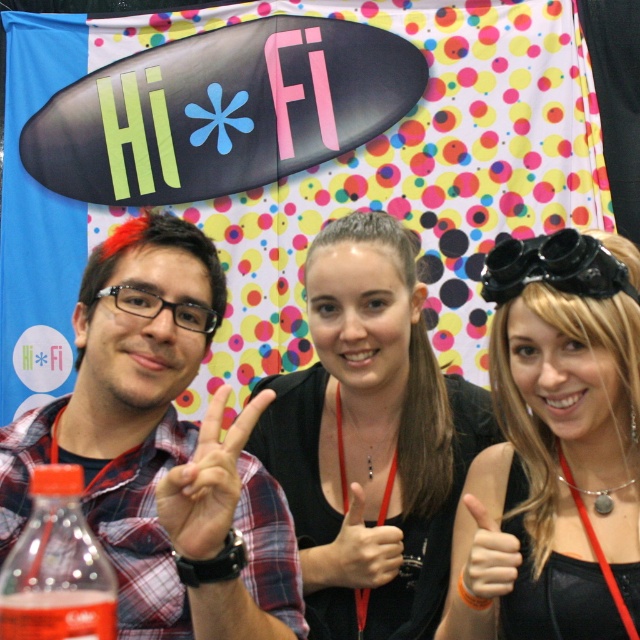
You are a photographer adjusting the lighting for a group photo. You need to ensure that the hand making the peace sign is well lit. The point at coordinates point (483, 548) is part of the hand. Where exactly on the hand is this point located?

The point (483, 548) indicates the smooth skin hand at center, so it is located on the smooth skin area of the hand making the peace sign.

You are a photographer adjusting the camera settings to focus on the plaid shirt at center and the smooth skin hand at center. Which object should you focus on first if you want to ensure the larger one is sharp?

The plaid shirt at center is larger in size than the smooth skin hand at center, so you should focus on the plaid shirt at center first to ensure it is sharp.